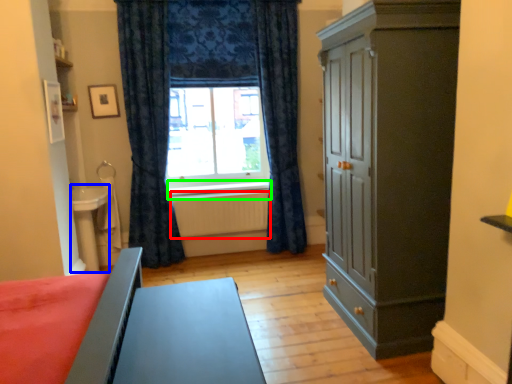
Question: Considering the real-world distances, which object is closest to radiator (highlighted by a red box)? table (highlighted by a blue box) or window sill (highlighted by a green box).

Choices:
 (A) table
 (B) window sill

Answer: (B)